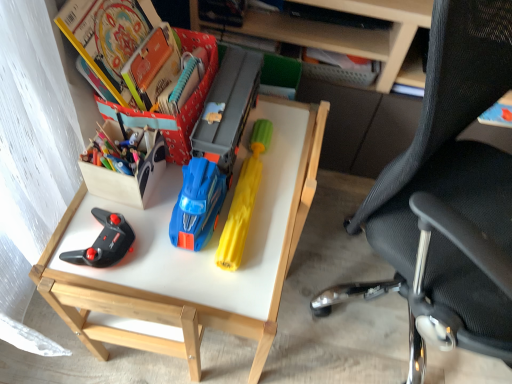
Question: Is hardcover book at upper left, positioned as the 3th book in back-to-front order, wider or thinner than matte paper book at upper left, placed as the first book when sorted from back to front?

Choices:
 (A) thin
 (B) wide

Answer: (A)

Question: From the image's perspective, is hardcover book at upper left, which is counted as the first book, starting from the front, positioned above or below matte paper book at upper left, placed as the first book when sorted from back to front?

Choices:
 (A) above
 (B) below

Answer: (A)

Question: Which of these objects is positioned closest to the wooden box at left?

Choices:
 (A) yellow rubber toy at center
 (B) matte paper book at upper left, placed as the first book when sorted from back to front
 (C) matte plastic desk at center
 (D) hardcover book at upper left, which is counted as the first book, starting from the front
 (E) black mesh chair at right

Answer: (B)

Question: Estimate the real-world distances between objects in this image. Which object is closer to the yellow rubber toy at center?

Choices:
 (A) matte paper book at upper left, placed as the first book when sorted from back to front
 (B) black mesh chair at right
 (C) orange cardboard book at upper left, the second book when ordered from back to front
 (D) wooden box at left
 (E) matte plastic desk at center

Answer: (E)